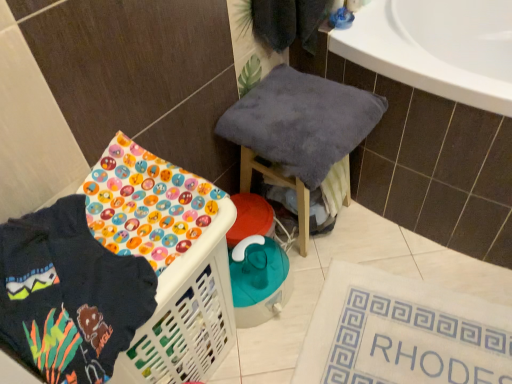
Question: Is white fabric bath mat at lower right closer to camera compared to dark blue fleece sweatshirt at lower left?

Choices:
 (A) no
 (B) yes

Answer: (A)

Question: Does white fabric bath mat at lower right have a lesser height compared to dark blue fleece sweatshirt at lower left?

Choices:
 (A) yes
 (B) no

Answer: (A)

Question: Could you tell me if white fabric bath mat at lower right is turned towards dark blue fleece sweatshirt at lower left?

Choices:
 (A) yes
 (B) no

Answer: (B)

Question: Is white fabric bath mat at lower right positioned behind dark blue fleece sweatshirt at lower left?

Choices:
 (A) no
 (B) yes

Answer: (B)

Question: From a real-world perspective, is white fabric bath mat at lower right under dark blue fleece sweatshirt at lower left?

Choices:
 (A) yes
 (B) no

Answer: (A)

Question: From the image's perspective, would you say white fabric bath mat at lower right is positioned over dark blue fleece sweatshirt at lower left?

Choices:
 (A) no
 (B) yes

Answer: (A)

Question: From a real-world perspective, is soft gray towel at center over dark blue fleece sweatshirt at lower left?

Choices:
 (A) no
 (B) yes

Answer: (A)

Question: Is soft gray towel at center thinner than dark blue fleece sweatshirt at lower left?

Choices:
 (A) no
 (B) yes

Answer: (A)

Question: Would you say soft gray towel at center contains dark blue fleece sweatshirt at lower left?

Choices:
 (A) no
 (B) yes

Answer: (A)

Question: Is the position of soft gray towel at center less distant than that of dark blue fleece sweatshirt at lower left?

Choices:
 (A) yes
 (B) no

Answer: (B)

Question: Is soft gray towel at center positioned with its back to dark blue fleece sweatshirt at lower left?

Choices:
 (A) yes
 (B) no

Answer: (B)

Question: Can you confirm if soft gray towel at center is smaller than dark blue fleece sweatshirt at lower left?

Choices:
 (A) no
 (B) yes

Answer: (A)

Question: Is soft gray towel at center far away from white fabric bath mat at lower right?

Choices:
 (A) yes
 (B) no

Answer: (B)